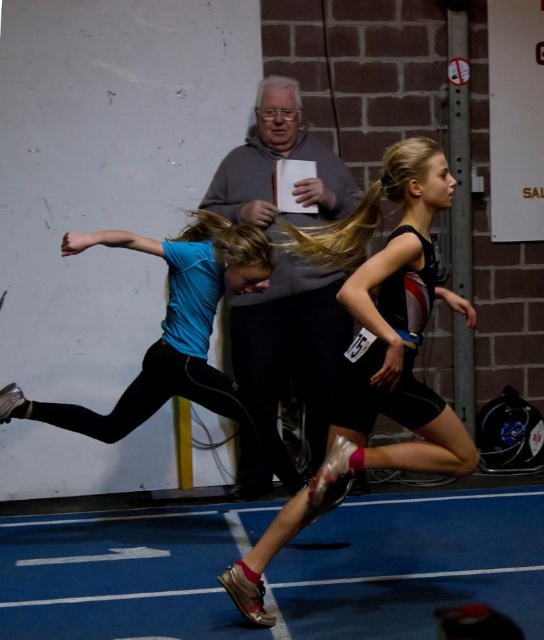
You are a photographer positioned at the starting line of the race. You need to capture a photo where both the gray matte jacket at center and the blue matte running suit at center are clearly visible. Based on their current positions, can you frame the shot so that neither object blocks the other?

The blue matte running suit at center is behind the gray matte jacket at center, so the gray matte jacket at center would block the blue matte running suit at center in the photo. To ensure both are visible, you need to adjust the angle or position to avoid overlap.

You are a photographer positioned at the starting line of the race. You need to capture a photo that includes both the black matte running suit at center and the gray matte jacket at center without any overlap. Given their positions, is this possible?

The black matte running suit at center might be wider than gray matte jacket at center, so there is a possibility that they might overlap in the photo. To ensure no overlap, adjust the camera angle or position to account for their widths.